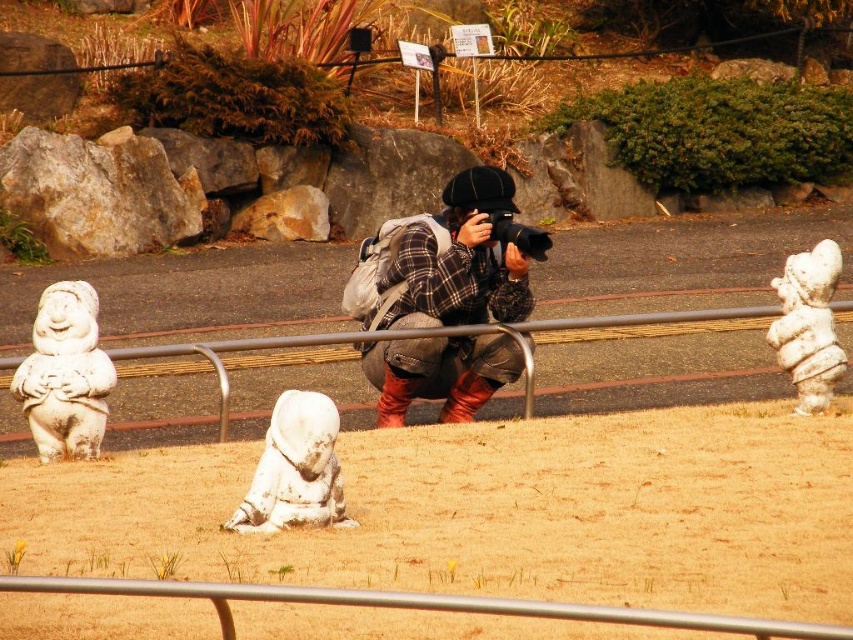
Can you confirm if plaid fabric camera at center is thinner than brushed metal rail at center?

Correct, plaid fabric camera at center's width is less than brushed metal rail at center's.

Consider the image. Which is above, plaid fabric camera at center or brushed metal rail at center?

plaid fabric camera at center is above.

Find the location of a particular element. This screenshot has height=640, width=853. plaid fabric camera at center is located at coordinates (450, 260).

From the picture: Who is shorter, white stone sculpture at left or brushed metal rail at center?

Standing shorter between the two is brushed metal rail at center.

Between white stone sculpture at left and brushed metal rail at center, which one is positioned higher?

white stone sculpture at left is above.

At what (x,y) coordinates should I click in order to perform the action: click on white stone sculpture at left. Please return your answer as a coordinate pair (x, y). This screenshot has height=640, width=853. Looking at the image, I should click on (65, 374).

This screenshot has height=640, width=853. I want to click on white stone sculpture at left, so click(65, 374).

Between white stone statue at center and brushed metal rail at center, which one is positioned lower?

white stone statue at center is below.

Is white stone statue at center wider than brushed metal rail at center?

Incorrect, white stone statue at center's width does not surpass brushed metal rail at center's.

Is point (338, 496) in front of point (286, 346)?

Yes, it is in front of point (286, 346).

Identify the location of white stone statue at center. (294, 468).